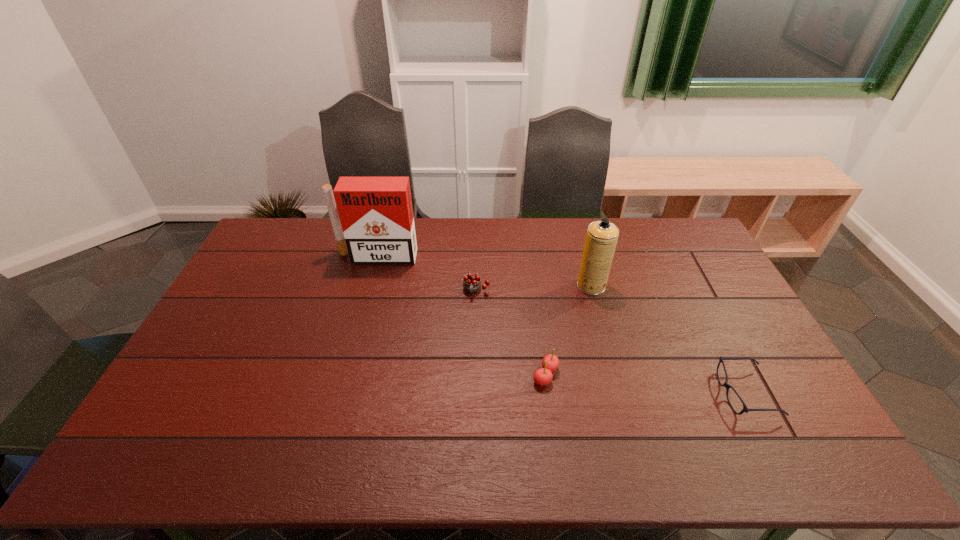
Where is `free space located on the back of the second object from right to left`? free space located on the back of the second object from right to left is located at coordinates (581, 246).

The height and width of the screenshot is (540, 960). Identify the location of vacant space located on the handle side of the farther cherry. (475, 409).

You are a GUI agent. You are given a task and a screenshot of the screen. Output one action in this format:
    pyautogui.click(x=<x>, y=<y>)
    Task: Click on the free space located 0.120m on the left of the nearer cherry
    The height and width of the screenshot is (540, 960).
    Given the screenshot: What is the action you would take?
    (x=489, y=375)

In order to click on vacant space located 0.320m on the front-facing side of the spectacles in this screenshot , I will do `click(599, 393)`.

Where is `free space located 0.260m on the front-facing side of the spectacles`? This screenshot has height=540, width=960. free space located 0.260m on the front-facing side of the spectacles is located at coordinates (622, 393).

You are a GUI agent. You are given a task and a screenshot of the screen. Output one action in this format:
    pyautogui.click(x=<x>, y=<y>)
    Task: Click on the free spot located 0.240m on the front-facing side of the spectacles
    
    Given the screenshot: What is the action you would take?
    pyautogui.click(x=629, y=393)

Where is `object that is at the far edge`? This screenshot has height=540, width=960. object that is at the far edge is located at coordinates (376, 213).

Where is `object located in the right edge section of the desktop`? The height and width of the screenshot is (540, 960). object located in the right edge section of the desktop is located at coordinates (745, 409).

I want to click on free space at the far edge of the desktop, so click(582, 220).

This screenshot has height=540, width=960. In order to click on free region at the near edge of the desktop in this screenshot , I will do `click(544, 440)`.